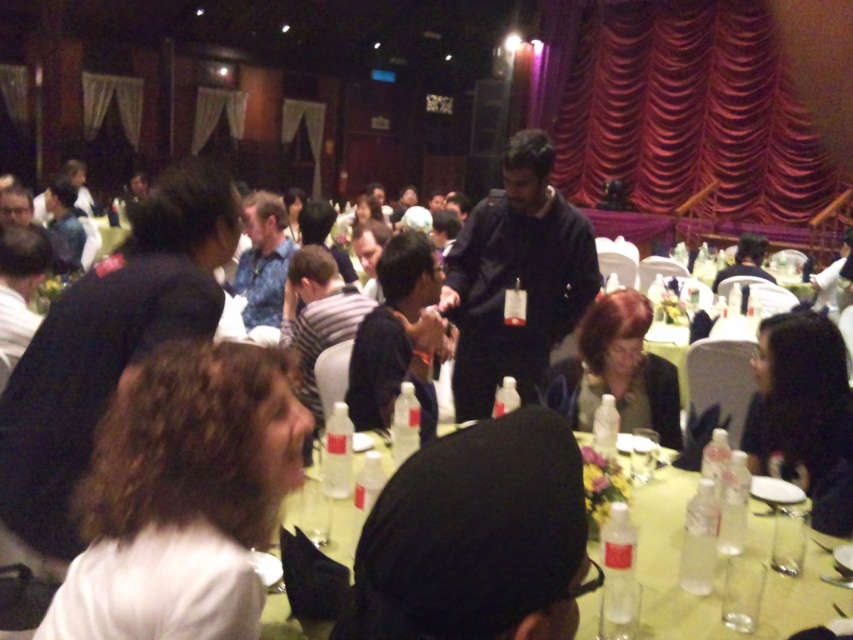
You are an event planner at the conference and need to arrange a photo shoot. You want to ensure that the black matte shirt at center and the matte black jacket at center are both visible in the frame. Given their height difference, which one should be positioned closer to the camera to maintain visibility?

The black matte shirt at center is taller than the matte black jacket at center, so positioning the matte black jacket at center closer to the camera would help ensure both are visible in the frame.

You are an event planner checking the stage setup. You notice the red velvet curtain at upper right and the black fabric cap at center. Which object is taller?

The red velvet curtain at upper right is taller than the black fabric cap at center.